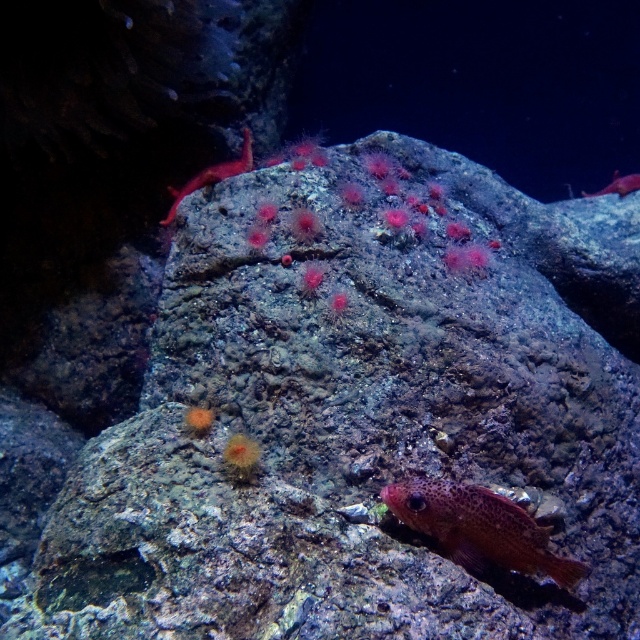
You are a diver exploring this underwater scene. You notice two points marked in the image. One is at coordinates point (452, 528) and the other at point (611, 180). Which point is closer to you as you face the rock?

Point (452, 528) is in front of point (611, 180), so it is closer to you as you face the rock.

You are a marine biologist observing an underwater scene. You notice the spotted orange fish at lower right and the translucent pink coral at upper center. Which of these two objects is shorter in height?

The spotted orange fish at lower right is not as tall as the translucent pink coral at upper center, so the spotted orange fish at lower right is shorter in height.